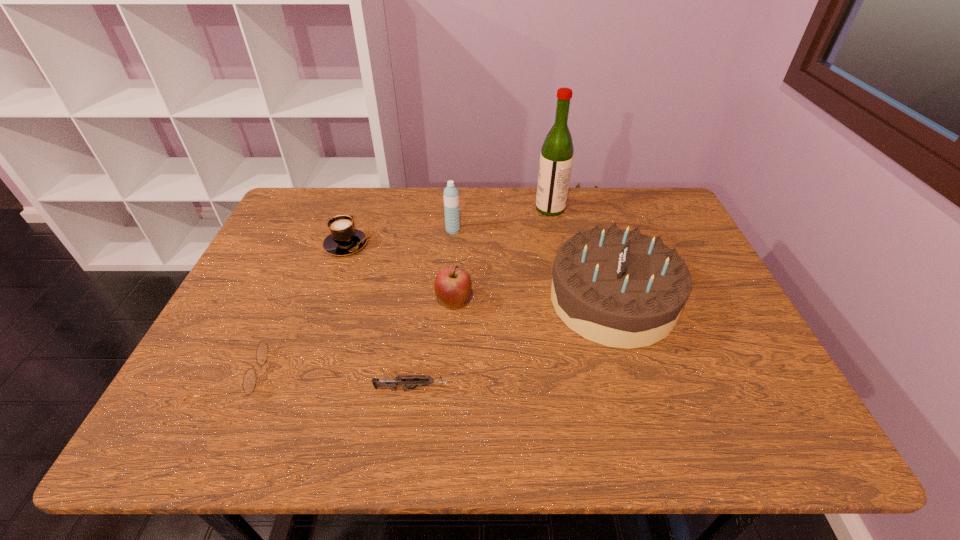
Identify which object is the nearest to the second object from left to right. Please provide its 2D coordinates. Your answer should be formatted as a tuple, i.e. [(x, y)], where the tuple contains the x and y coordinates of a point satisfying the conditions above.

[(451, 194)]

The image size is (960, 540). I want to click on vacant space that satisfies the following two spatial constraints: 1. on the label of the farthest object; 2. on the front side of the fourth tallest object, so click(x=569, y=302).